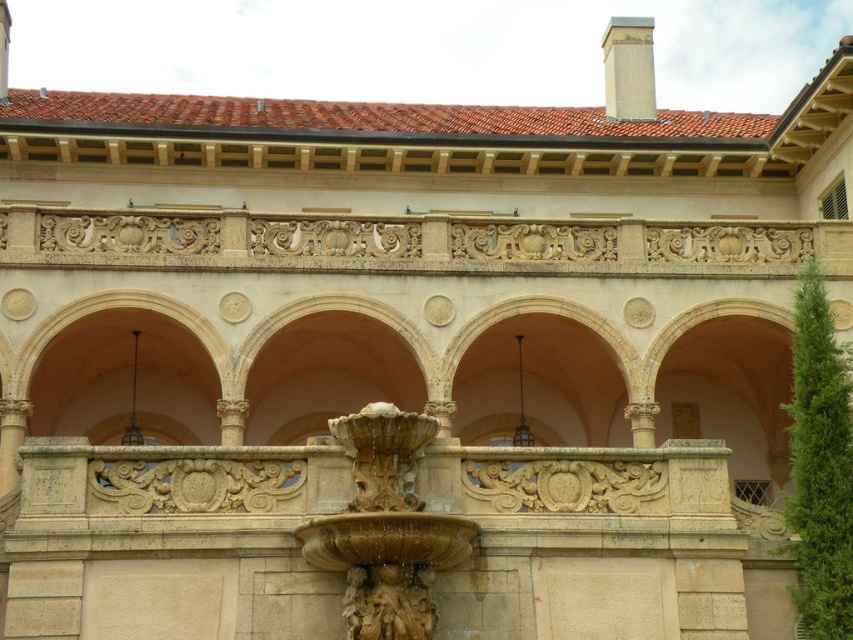
Does point (386, 520) come in front of point (630, 44)?

Yes, point (386, 520) is in front of point (630, 44).

Which is in front, point (398, 484) or point (634, 96)?

Point (398, 484)

Describe the element at coordinates (386, 528) in the screenshot. The width and height of the screenshot is (853, 640). I see `carved stone fountain at center` at that location.

The height and width of the screenshot is (640, 853). In order to click on carved stone fountain at center in this screenshot , I will do `click(386, 528)`.